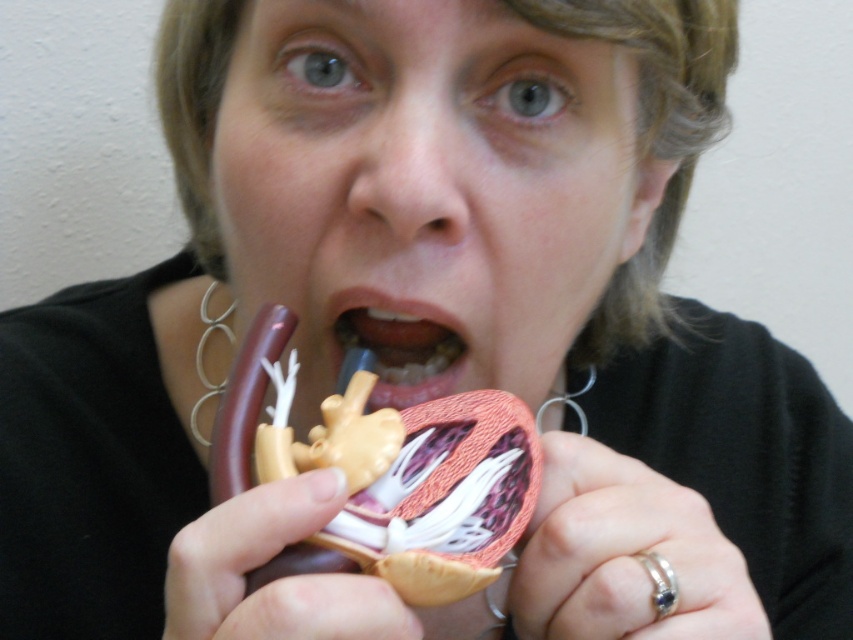
Is smooth plastic heart at center closer to camera compared to pink matte heart at center?

Yes, it is.

Is smooth plastic heart at center to the right of pink matte heart at center from the viewer's perspective?

Indeed, smooth plastic heart at center is positioned on the right side of pink matte heart at center.

Is point (395, 435) less distant than point (392, 400)?

Yes.

This screenshot has width=853, height=640. I want to click on smooth plastic heart at center, so click(421, 484).